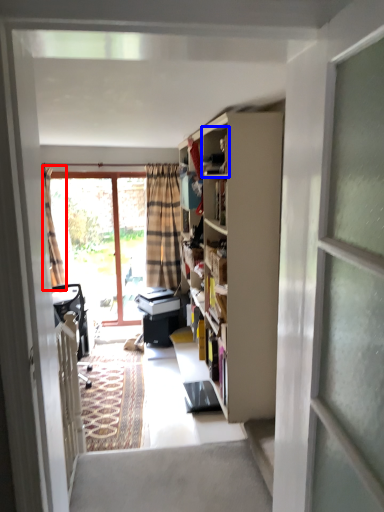
Question: Which point is further to the camera, curtain (highlighted by a red box) or cabinet (highlighted by a blue box)?

Choices:
 (A) curtain
 (B) cabinet

Answer: (A)